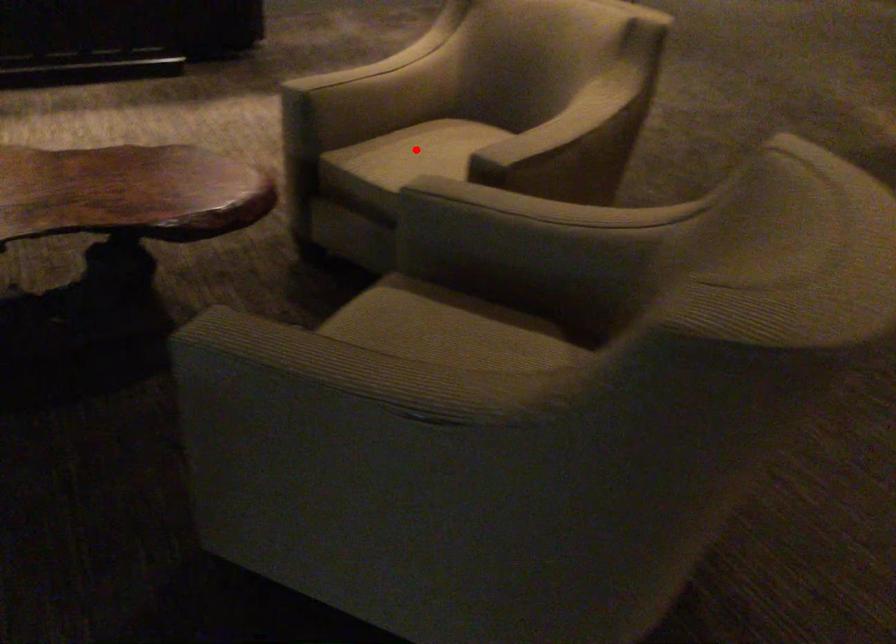
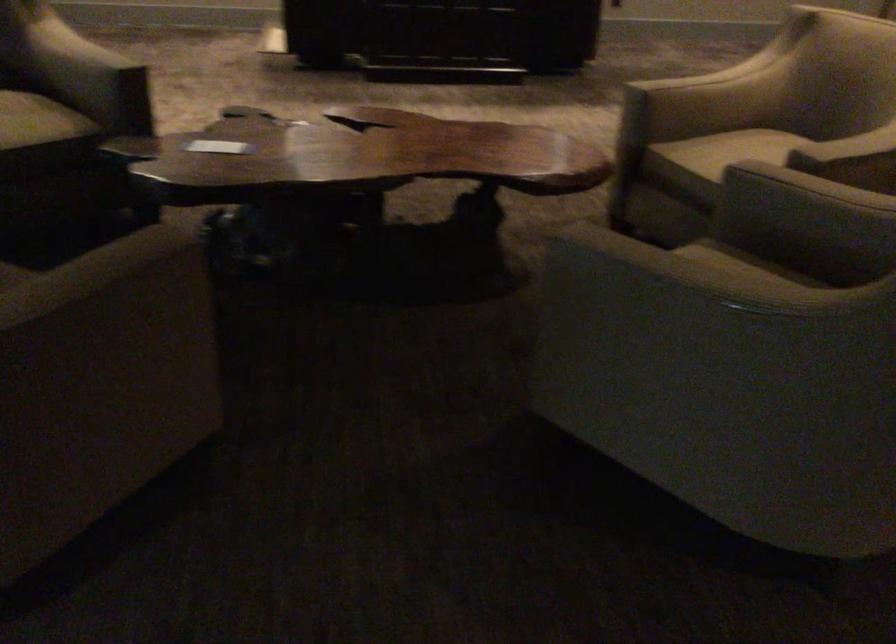
Where in the second image is the point corresponding to the highlighted location from the first image?

(741, 149)